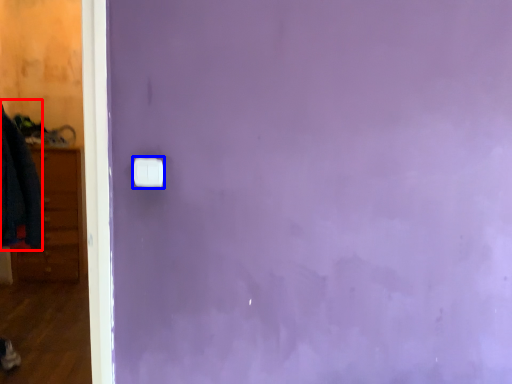
Question: Which point is further to the camera, clothing (highlighted by a red box) or light switch (highlighted by a blue box)?

Choices:
 (A) clothing
 (B) light switch

Answer: (A)